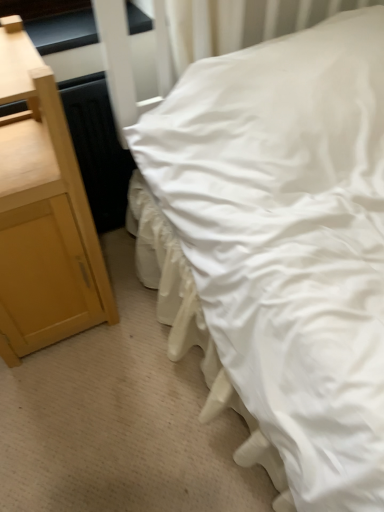
Where is `white smooth bed at center`? The image size is (384, 512). white smooth bed at center is located at coordinates (302, 238).

This screenshot has height=512, width=384. Describe the element at coordinates (302, 238) in the screenshot. I see `white smooth bed at center` at that location.

Identify the location of black glossy window sill at upper left. (63, 31).

Is light wood/texture nightstand at left situated inside black glossy window sill at upper left or outside?

light wood/texture nightstand at left is not inside black glossy window sill at upper left, it's outside.

From the image's perspective, is light wood/texture nightstand at left located above black glossy window sill at upper left?

No, from the image's perspective, light wood/texture nightstand at left is not on top of black glossy window sill at upper left.

Considering the relative sizes of light wood/texture nightstand at left and black glossy window sill at upper left in the image provided, is light wood/texture nightstand at left taller than black glossy window sill at upper left?

Yes, light wood/texture nightstand at left is taller than black glossy window sill at upper left.

Which point is more distant from viewer, (13, 142) or (77, 26)?

The point (77, 26) is more distant.

Does point (130, 25) come farther from viewer compared to point (18, 264)?

Yes, it is behind point (18, 264).

Can you confirm if black glossy window sill at upper left is positioned to the left of light wood/texture nightstand at left?

In fact, black glossy window sill at upper left is to the right of light wood/texture nightstand at left.

Can you tell me how much black glossy window sill at upper left and light wood/texture nightstand at left differ in facing direction?

1.03 degrees.

Which is less distant, [349,474] or [8,260]?

Positioned in front is point [349,474].

Considering the sizes of objects white smooth bed at center and light wood/texture nightstand at left in the image provided, who is thinner, white smooth bed at center or light wood/texture nightstand at left?

light wood/texture nightstand at left.

Do you think white smooth bed at center is within light wood/texture nightstand at left, or outside of it?

white smooth bed at center lies outside light wood/texture nightstand at left.

Is black glossy window sill at upper left shorter than white smooth bed at center?

Correct, black glossy window sill at upper left is not as tall as white smooth bed at center.

Identify the location of window sill lying above the white smooth bed at center (from the image's perspective). The image size is (384, 512). (63, 31).

Is white smooth bed at center at the back of black glossy window sill at upper left?

No, black glossy window sill at upper left is not facing the opposite direction of white smooth bed at center.

This screenshot has width=384, height=512. I want to click on window sill on the left of white smooth bed at center, so click(63, 31).

Does point (359, 232) lie in front of point (71, 26)?

Yes, point (359, 232) is in front of point (71, 26).

Between white smooth bed at center and black glossy window sill at upper left, which one has larger size?

white smooth bed at center.

Is white smooth bed at center at the back of light wood/texture nightstand at left?

That's not correct — light wood/texture nightstand at left is not looking away from white smooth bed at center.

Considering the points (36, 259) and (217, 316), which point is behind, point (36, 259) or point (217, 316)?

The point (36, 259) is more distant.

Considering the positions of objects light wood/texture nightstand at left and white smooth bed at center in the image provided, who is behind, light wood/texture nightstand at left or white smooth bed at center?

Positioned behind is light wood/texture nightstand at left.

Who is shorter, light wood/texture nightstand at left or white smooth bed at center?

light wood/texture nightstand at left is shorter.

In the image, there is a black glossy window sill at upper left. Identify the location of nightstand below it (from a real-world perspective). The width and height of the screenshot is (384, 512). (43, 211).

Image resolution: width=384 pixels, height=512 pixels. In order to click on nightstand on the left of black glossy window sill at upper left in this screenshot , I will do pos(43,211).

Based on their spatial positions, is black glossy window sill at upper left or light wood/texture nightstand at left closer to white smooth bed at center?

light wood/texture nightstand at left is closer to white smooth bed at center.

Which object lies nearer to the anchor point black glossy window sill at upper left, light wood/texture nightstand at left or white smooth bed at center?

Based on the image, light wood/texture nightstand at left appears to be nearer to black glossy window sill at upper left.

When comparing their distances from black glossy window sill at upper left, does white smooth bed at center or light wood/texture nightstand at left seem closer?

The object closer to black glossy window sill at upper left is light wood/texture nightstand at left.

Looking at the image, which one is located closer to white smooth bed at center, light wood/texture nightstand at left or black glossy window sill at upper left?

Based on the image, light wood/texture nightstand at left appears to be nearer to white smooth bed at center.

From the image, which object appears to be farther from light wood/texture nightstand at left, black glossy window sill at upper left or white smooth bed at center?

Among the two, black glossy window sill at upper left is located further to light wood/texture nightstand at left.

In the scene shown: Based on their spatial positions, is white smooth bed at center or black glossy window sill at upper left further from light wood/texture nightstand at left?

black glossy window sill at upper left.

This screenshot has height=512, width=384. I want to click on nightstand positioned between white smooth bed at center and black glossy window sill at upper left from near to far, so click(x=43, y=211).